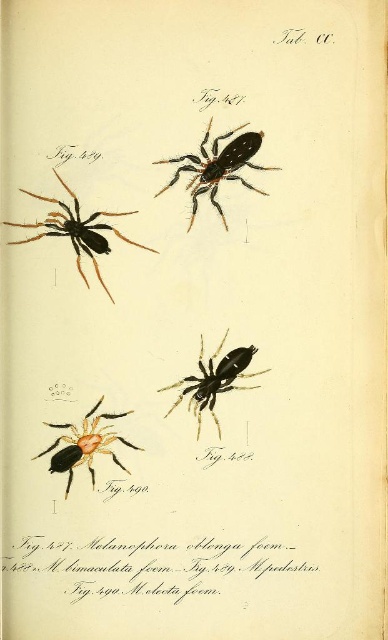
Between black matte spider at upper center and black matte spider at center, which one appears on the left side from the viewer's perspective?

Positioned to the left is black matte spider at center.

Between point (209, 124) and point (171, 387), which one is positioned behind?

Positioned behind is point (171, 387).

Where is `black matte spider at upper center`? This screenshot has width=388, height=640. black matte spider at upper center is located at coordinates (216, 166).

Which is below, matte black spider at upper left or orange matte spider at lower left?

Positioned lower is orange matte spider at lower left.

Is point (34, 241) farther from viewer compared to point (93, 476)?

That is True.

The height and width of the screenshot is (640, 388). In order to click on matte black spider at upper left in this screenshot , I will do `click(76, 230)`.

Does matte black spider at upper left have a lesser height compared to black matte spider at center?

No, matte black spider at upper left is not shorter than black matte spider at center.

Looking at this image, is matte black spider at upper left further to camera compared to black matte spider at center?

No.

I want to click on matte black spider at upper left, so click(x=76, y=230).

Where is `matte black spider at upper left`? The height and width of the screenshot is (640, 388). matte black spider at upper left is located at coordinates (76, 230).